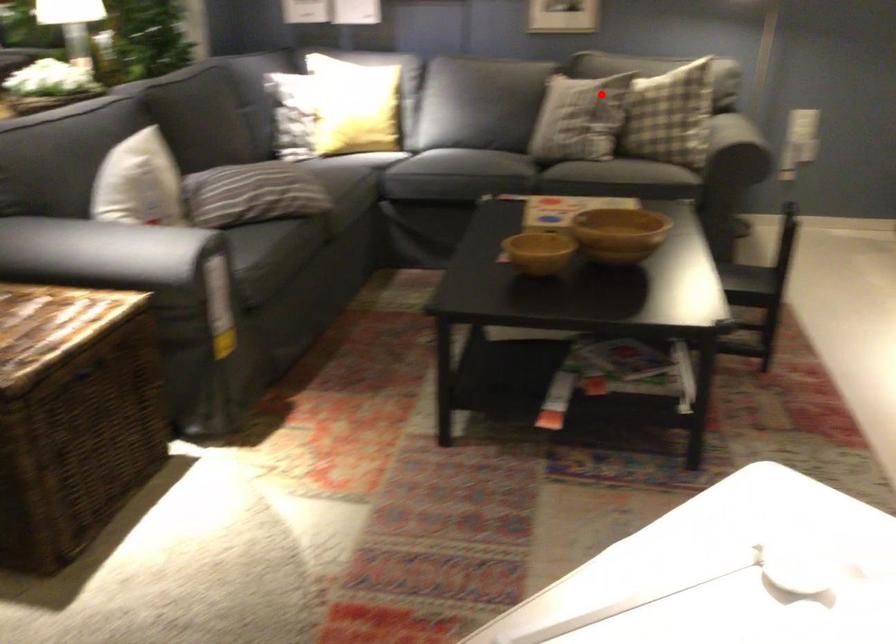
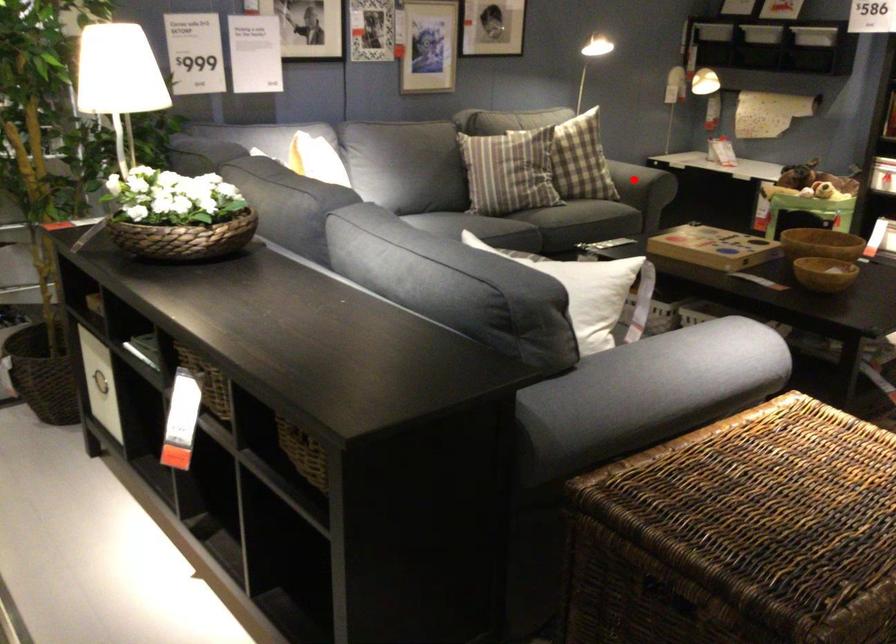
I am providing you with two images of the same scene from different viewpoints. A red point is marked on the first image and another point is marked on the second image. Are the points marked in image1 and image2 representing the same 3D position?

No